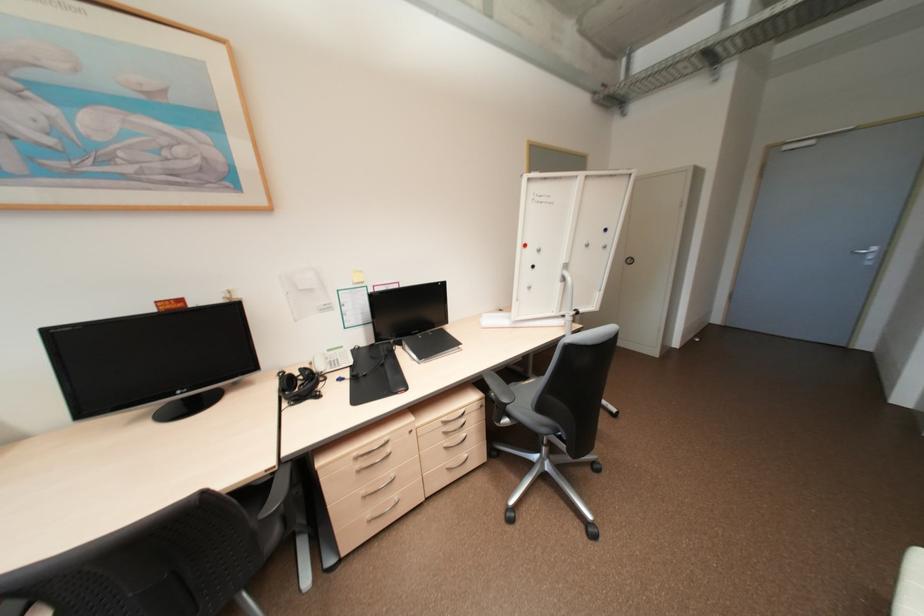
This screenshot has width=924, height=616. In order to click on black headset in this screenshot , I will do `click(299, 385)`.